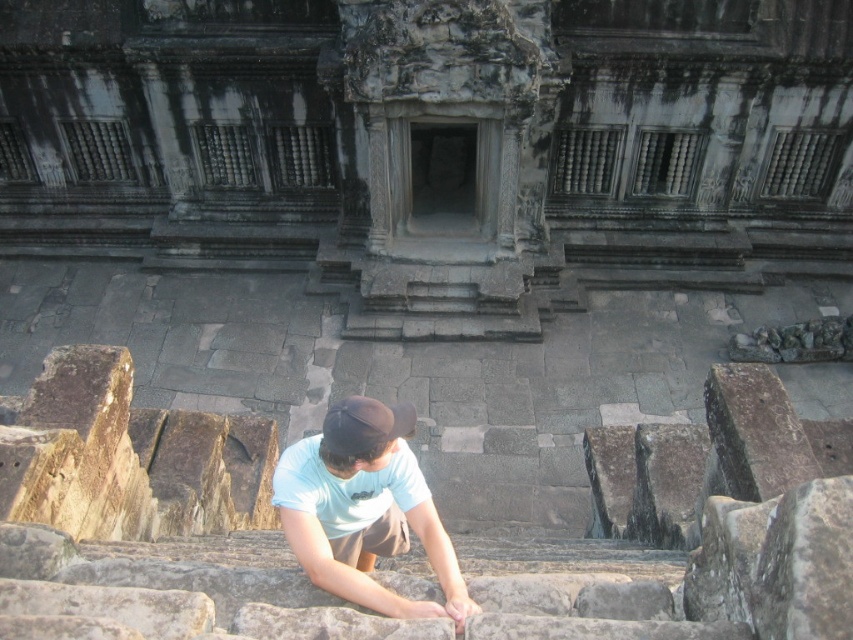
Looking at this image, you are standing at the bottom of the ancient stone stairs in the historical site. You see two points marked on the steps. The first point is at coordinate point (355, 577) and the second is at point (334, 452). If you were to walk up the stairs, which point would you encounter first?

The point at coordinate point (355, 577) is in front of point (334, 452), so you would encounter the point (355, 577) first as you ascend the stairs.